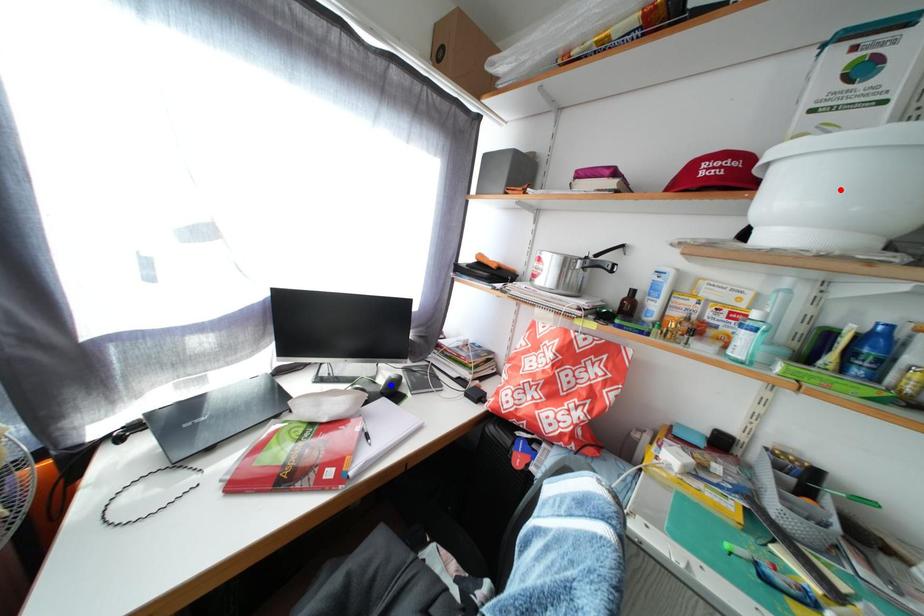
Question: Which of the two points in the image is closer to the camera?

Choices:
 (A) Blue point is closer.
 (B) Red point is closer.

Answer: (B)